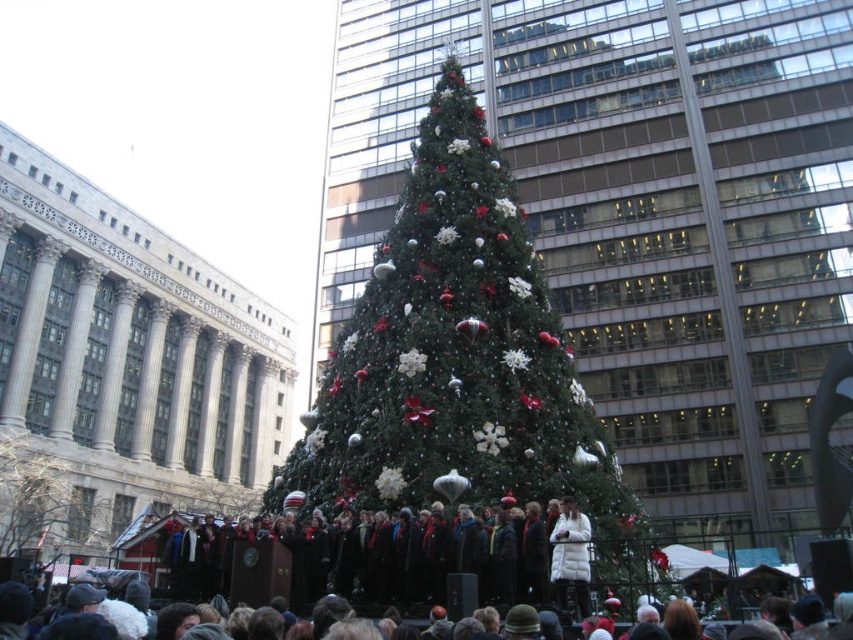
You are standing in the public square and want to take a photo of the green matte christmas tree at center. If your camera has a maximum focus range of 70 meters, will you be able to capture the tree clearly?

The distance between you and the green matte christmas tree at center is 73.92 meters, which exceeds the camera maximum focus range of 70 meters. Therefore, you won not be able to capture the tree clearly.

You are a photographer trying to capture a photo of the green textured christmas tree at center and the dark brown hair at lower center. Which object should you focus on first if you want to ensure both are in focus?

The dark brown hair at lower center is closer to you than the green textured christmas tree at center, so you should focus on the dark brown hair at lower center first to ensure both are in focus.